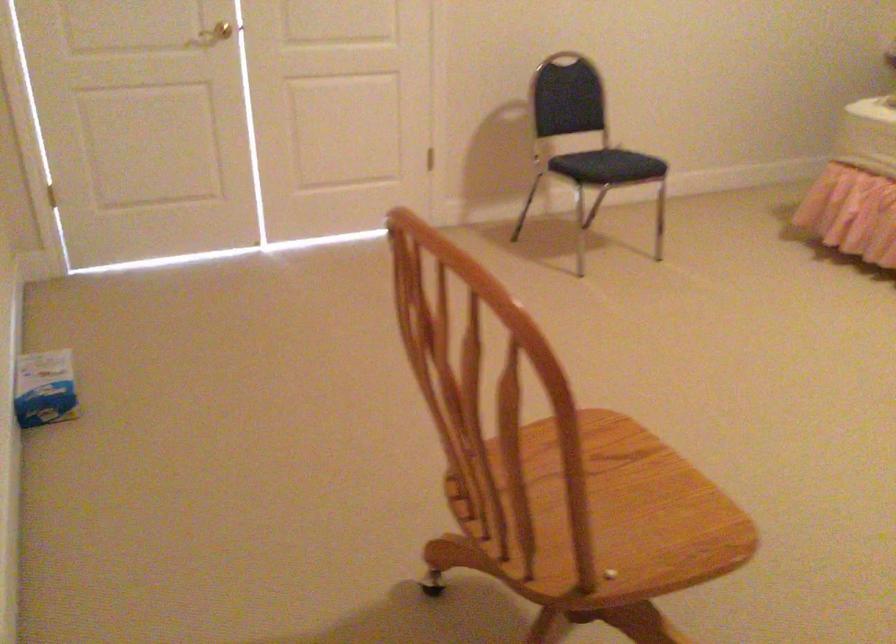
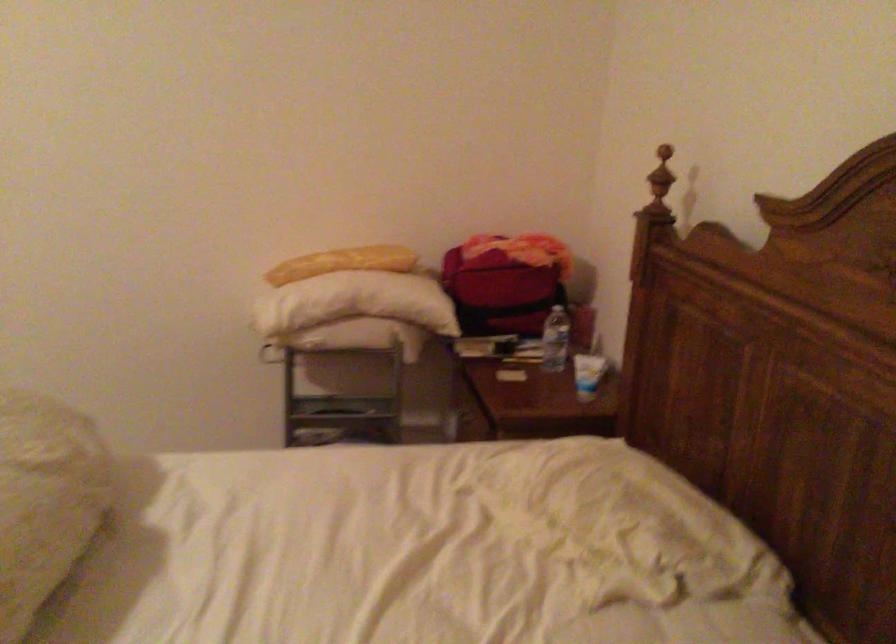
What movement of the cameraman would produce the second image?

The cameraman moved toward right, forward.